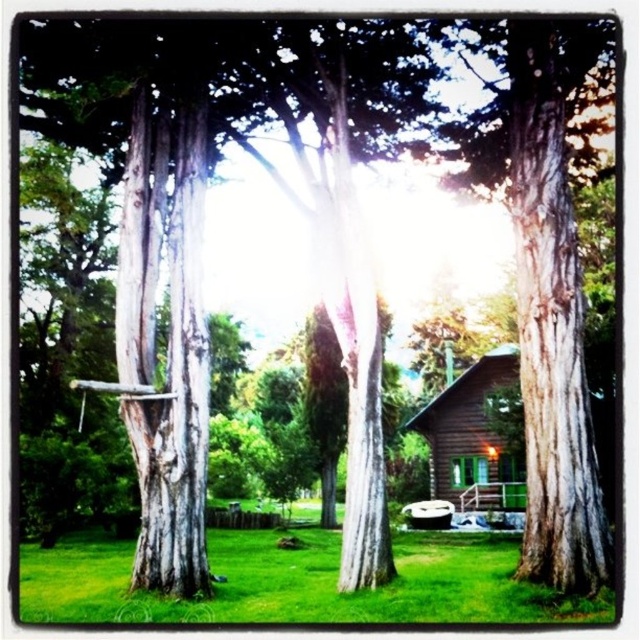
You are standing at the center of the image and want to walk to the green grass at lower center. According to the coordinates provided, in which direction should you move to reach it?

The green grass at lower center is located at coordinates point (300, 582). Since the center of the image is at point (320, 320), you should move towards the lower right direction to reach it.

You are standing in front of the gray textured tree trunk at left and the brown wooden cabin at center. Which object is closer to you?

The gray textured tree trunk at left is closer to you because it is positioned in front of the brown wooden cabin at center.

You are standing at the entrance of the rustic wooden cabin and notice two points marked on the ground. The first point is labeled as point (99, 614) and the second as point (144, 314). If you want to walk towards the point that is closer to you, which point should you head towards?

Point (99, 614) is in front of point (144, 314), so you should head towards point (99, 614) as it is closer to you.